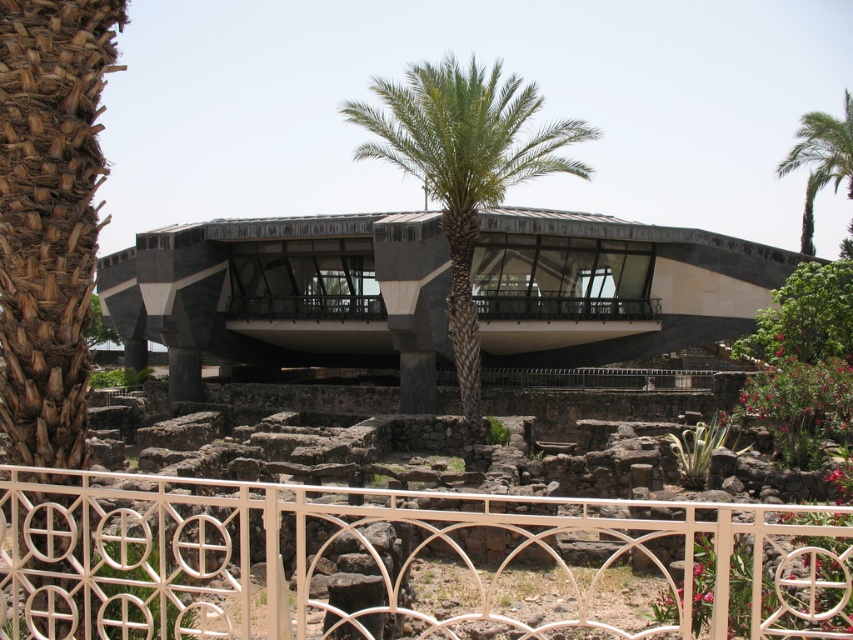
You are standing at the archaeological site and want to take a photo of the brown rough bark at left and the green leafy palm tree at upper right. Which object is positioned higher in the image?

The green leafy palm tree at upper right is positioned higher in the image than the brown rough bark at left.

You are a park ranger planning to install a new bench between the brown rough bark at left and the green leafy tree at upper right. The bench requires a minimum of 30 meters of space between them to ensure visitor comfort. Can the bench be placed there?

The brown rough bark at left is 32.59 meters from the green leafy tree at upper right, which exceeds the required 30 meters. Therefore, the bench can be placed between them to meet visitor comfort standards.

You are standing at the archaeological site and want to take a photo of the white metal fence at lower center and the green leafy palm tree at center. Which object should you focus on first if you want to include both in the frame without moving your camera?

You should focus on the white metal fence at lower center first because it is smaller than the green leafy palm tree at center, so capturing it first ensures both fit within the frame.